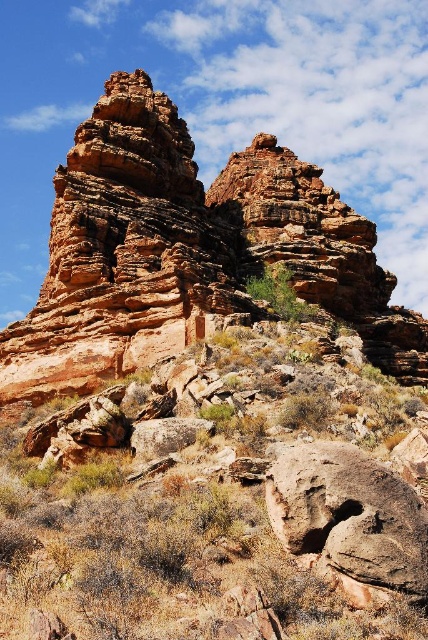
Is rustic sandstone rock formation at center bigger than rusty rock at lower right?

Yes.

Can you confirm if rustic sandstone rock formation at center is positioned above rusty rock at lower right?

Correct, rustic sandstone rock formation at center is located above rusty rock at lower right.

What do you see at coordinates (187, 252) in the screenshot? Image resolution: width=428 pixels, height=640 pixels. I see `rustic sandstone rock formation at center` at bounding box center [187, 252].

Find the location of a particular element. The width and height of the screenshot is (428, 640). rustic sandstone rock formation at center is located at coordinates [187, 252].

Does rustic rock hillside at center have a lesser width compared to rusty rock at lower right?

Incorrect, rustic rock hillside at center's width is not less than rusty rock at lower right's.

Between rustic rock hillside at center and rusty rock at lower right, which one appears on the right side from the viewer's perspective?

rusty rock at lower right is more to the right.

Between point (344, 486) and point (404, 492), which one is positioned in front?

Point (344, 486)

Identify the location of rustic rock hillside at center. The image size is (428, 640). (219, 500).

Can you confirm if rustic rock hillside at center is smaller than rustic sandstone rock formation at center?

Indeed, rustic rock hillside at center has a smaller size compared to rustic sandstone rock formation at center.

Is rustic rock hillside at center below rustic sandstone rock formation at center?

Indeed, rustic rock hillside at center is positioned under rustic sandstone rock formation at center.

In order to click on rustic rock hillside at center in this screenshot , I will do `click(219, 500)`.